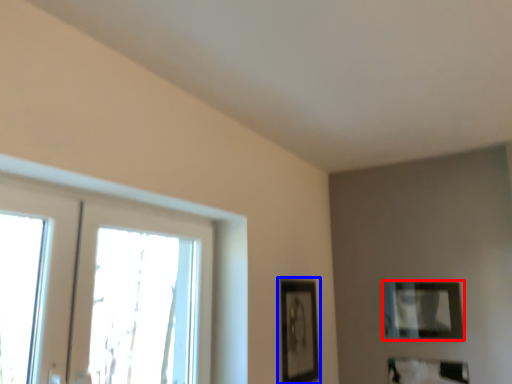
Question: Which object appears farthest to the camera in this image, picture frame (highlighted by a red box) or picture frame (highlighted by a blue box)?

Choices:
 (A) picture frame
 (B) picture frame

Answer: (A)